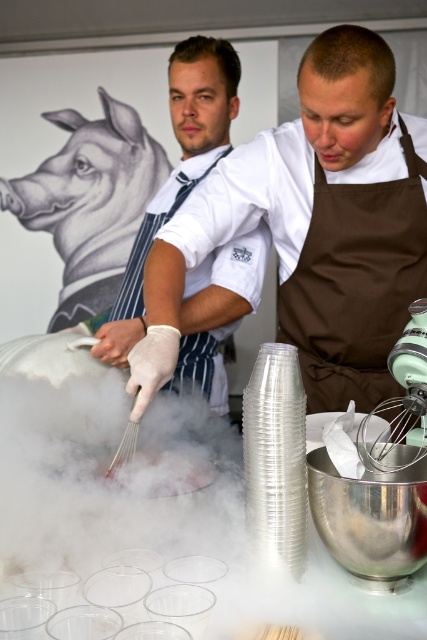
Which is in front, point (132, 305) or point (132, 448)?

Positioned in front is point (132, 448).

Does white striped apron at center have a greater width compared to white wire whisk at center?

Correct, the width of white striped apron at center exceeds that of white wire whisk at center.

Who is more forward, (221, 77) or (134, 452)?

Point (134, 452)

Where is `white striped apron at center`? The image size is (427, 640). white striped apron at center is located at coordinates (178, 168).

Measure the distance between metallic silver mixing bowl at center and white wire whisk at center.

metallic silver mixing bowl at center and white wire whisk at center are 10.47 inches apart.

Which is in front, point (333, 484) or point (119, 460)?

Point (333, 484) is in front.

Which is behind, point (335, 499) or point (125, 460)?

The point (125, 460) is more distant.

Find the location of a particular element. metallic silver mixing bowl at center is located at coordinates (371, 518).

From the picture: Between white striped apron at center and metallic silver mixing bowl at center, which one has less height?

Standing shorter between the two is metallic silver mixing bowl at center.

Does white striped apron at center appear under metallic silver mixing bowl at center?

No.

Which is behind, point (101, 339) or point (424, 560)?

Positioned behind is point (101, 339).

At what (x,y) coordinates should I click in order to perform the action: click on white striped apron at center. Please return your answer as a coordinate pair (x, y). The image size is (427, 640). Looking at the image, I should click on (178, 168).